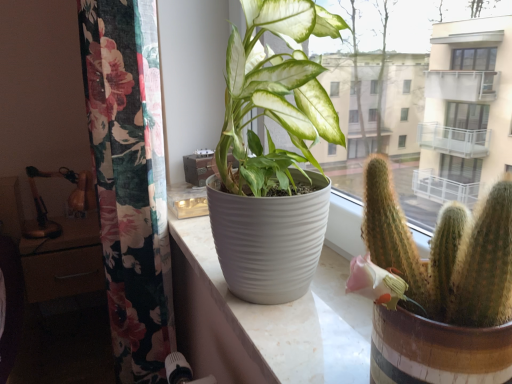
Question: Should I look upward or downward to see matte brown drawer at left?

Choices:
 (A) down
 (B) up

Answer: (A)

Question: Does matte brown drawer at left appear on the left side of white ribbed pot at center?

Choices:
 (A) yes
 (B) no

Answer: (A)

Question: Is matte brown drawer at left next to white ribbed pot at center?

Choices:
 (A) no
 (B) yes

Answer: (A)

Question: Is white ribbed pot at center surrounded by matte brown drawer at left?

Choices:
 (A) yes
 (B) no

Answer: (B)

Question: Is white ribbed pot at center at the back of matte brown drawer at left?

Choices:
 (A) yes
 (B) no

Answer: (B)

Question: Is matte brown drawer at left oriented towards white ribbed pot at center?

Choices:
 (A) yes
 (B) no

Answer: (A)

Question: Does matte brown drawer at left have a lesser width compared to white ribbed pot at center?

Choices:
 (A) yes
 (B) no

Answer: (B)

Question: Is white ribbed pot at center taller than green spiky cactus at right?

Choices:
 (A) no
 (B) yes

Answer: (A)

Question: Does white ribbed pot at center have a smaller size compared to green spiky cactus at right?

Choices:
 (A) no
 (B) yes

Answer: (A)

Question: Considering the relative positions of white ribbed pot at center and green spiky cactus at right in the image provided, is white ribbed pot at center to the right of green spiky cactus at right from the viewer's perspective?

Choices:
 (A) no
 (B) yes

Answer: (A)

Question: Does white ribbed pot at center have a lesser width compared to green spiky cactus at right?

Choices:
 (A) no
 (B) yes

Answer: (A)

Question: Is green spiky cactus at right a part of white ribbed pot at center?

Choices:
 (A) no
 (B) yes

Answer: (A)

Question: Is white ribbed pot at center not within green spiky cactus at right?

Choices:
 (A) yes
 (B) no

Answer: (A)

Question: Is the depth of matte brown drawer at left less than that of green spiky cactus at right?

Choices:
 (A) no
 (B) yes

Answer: (A)